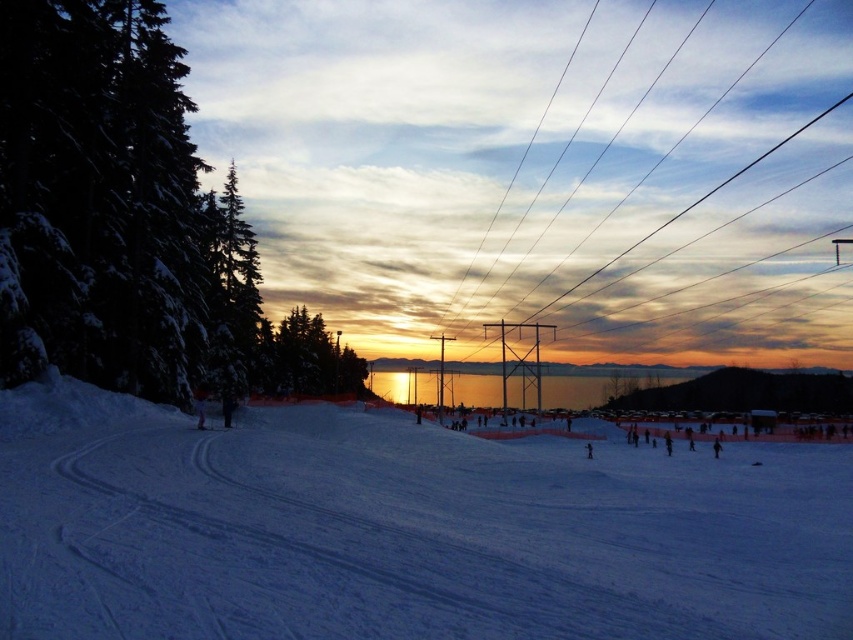
Which is above, white powdery snow at center or green matte tree at center-left?

green matte tree at center-left

Which is more to the left, white powdery snow at center or green matte tree at center-left?

Positioned to the left is green matte tree at center-left.

Is point (91, 560) positioned behind point (309, 365)?

No.

The height and width of the screenshot is (640, 853). Find the location of `white powdery snow at center`. white powdery snow at center is located at coordinates (404, 531).

Is snow-covered evergreen trees at left taller than black wire at center?

No.

Does snow-covered evergreen trees at left have a larger size compared to black wire at center?

Incorrect, snow-covered evergreen trees at left is not larger than black wire at center.

Does point (178, 154) lie in front of point (572, 253)?

Yes, it is.

Locate an element on the screen. The height and width of the screenshot is (640, 853). snow-covered evergreen trees at left is located at coordinates (128, 221).

Is white powdery snow at center above snow-covered evergreen trees at left?

Incorrect, white powdery snow at center is not positioned above snow-covered evergreen trees at left.

Which is behind, point (840, 532) or point (13, 268)?

The point (13, 268) is behind.

Which is in front, point (16, 445) or point (144, 304)?

Point (16, 445)

Identify the location of white powdery snow at center. (404, 531).